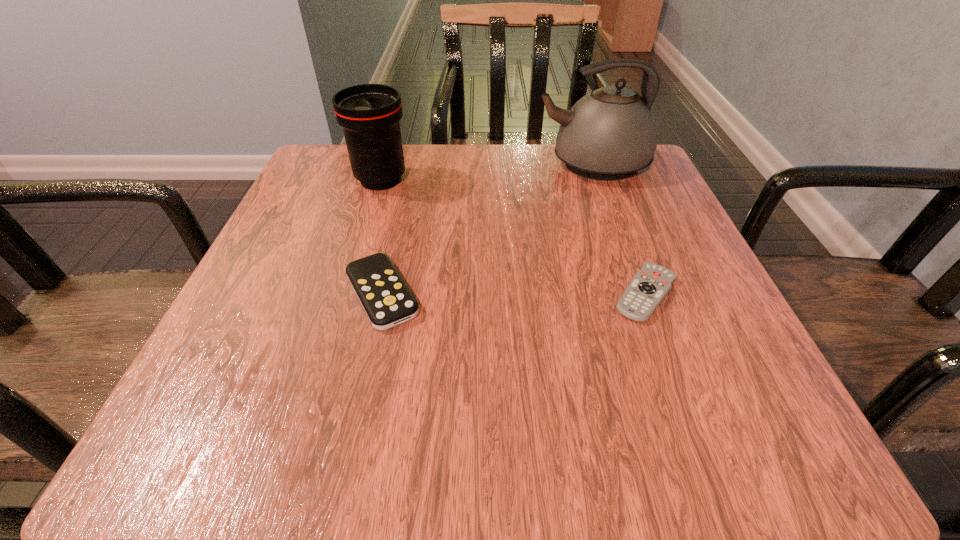
At what (x,y) coordinates should I click in order to perform the action: click on vacant area at the far edge. Please return your answer as a coordinate pair (x, y). Looking at the image, I should click on [x=547, y=190].

Where is `vacant space at the left edge of the desktop`? This screenshot has height=540, width=960. vacant space at the left edge of the desktop is located at coordinates (291, 240).

At what (x,y) coordinates should I click in order to perform the action: click on free location at the right edge. Please return your answer as a coordinate pair (x, y). Looking at the image, I should click on (669, 266).

Find the location of a particular element. This screenshot has height=540, width=960. vacant region at the far left corner of the desktop is located at coordinates (332, 191).

At what (x,y) coordinates should I click in order to perform the action: click on free space at the far right corner of the desktop. Please return your answer as a coordinate pair (x, y). The height and width of the screenshot is (540, 960). Looking at the image, I should click on (585, 182).

This screenshot has width=960, height=540. What are the coordinates of `vacant region at the near right corner of the desktop` in the screenshot? It's located at (658, 403).

Identify the location of vacant space in between the second shortest object and the kettle. Image resolution: width=960 pixels, height=540 pixels. (487, 229).

This screenshot has width=960, height=540. I want to click on free spot between the tallest object and the shortest object, so click(619, 229).

What are the coordinates of `vacant point located between the shorter remote control and the third tallest object` in the screenshot? It's located at coord(514,294).

The height and width of the screenshot is (540, 960). Identify the location of vacant point located between the telephoto lens and the tallest object. (487, 172).